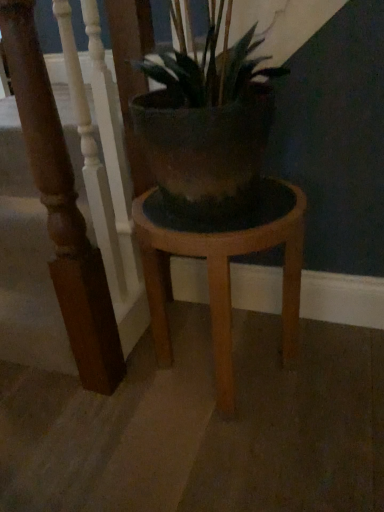
Where is `vacant space in front of wooden stool at center`? The width and height of the screenshot is (384, 512). vacant space in front of wooden stool at center is located at coordinates (237, 460).